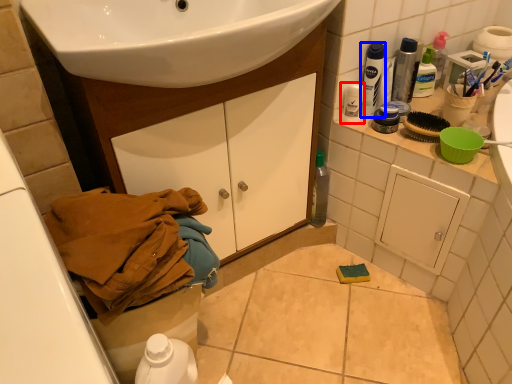
Question: Which object appears farthest to the camera in this image, toiletry (highlighted by a red box) or mouthwash (highlighted by a blue box)?

Choices:
 (A) toiletry
 (B) mouthwash

Answer: (A)